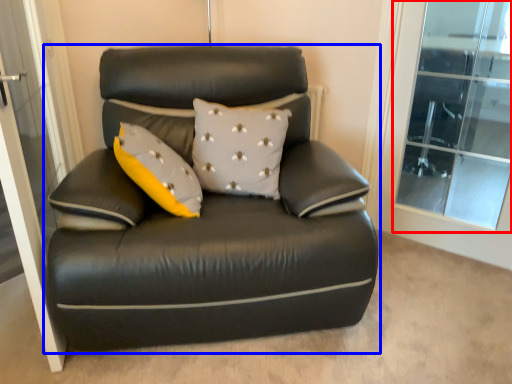
Question: Which of the following is the farthest to the observer, window (highlighted by a red box) or studio couch (highlighted by a blue box)?

Choices:
 (A) window
 (B) studio couch

Answer: (A)